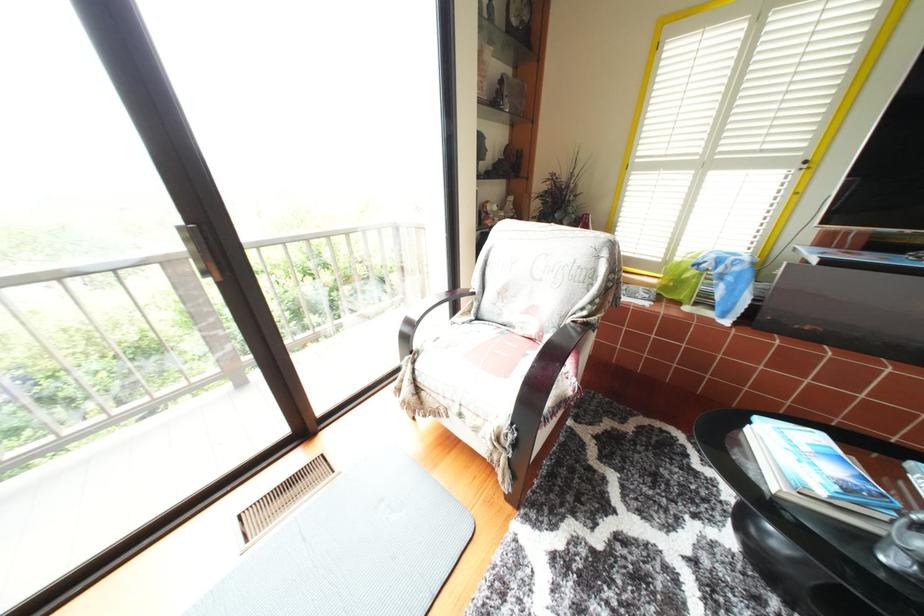
I want to click on shutter adjustment lever, so click(198, 252).